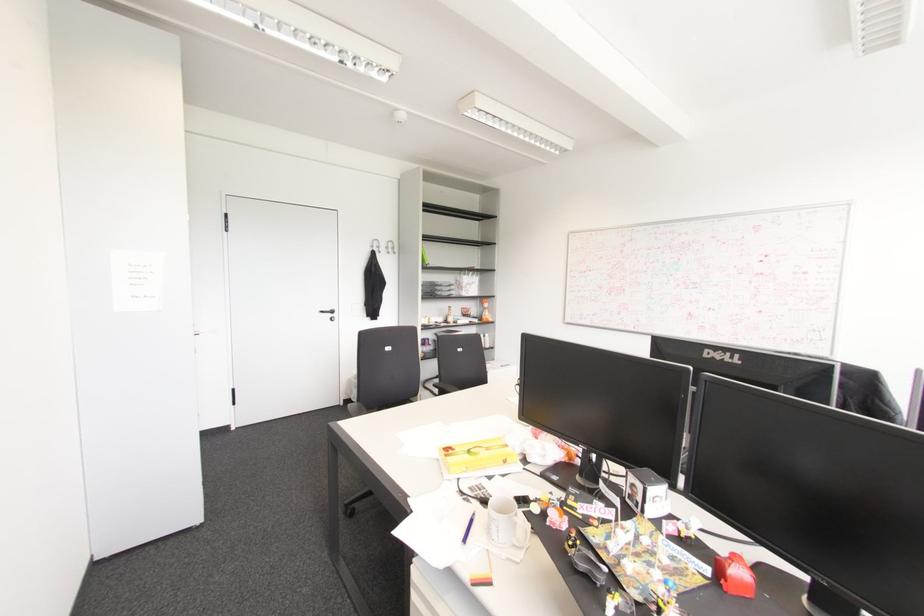
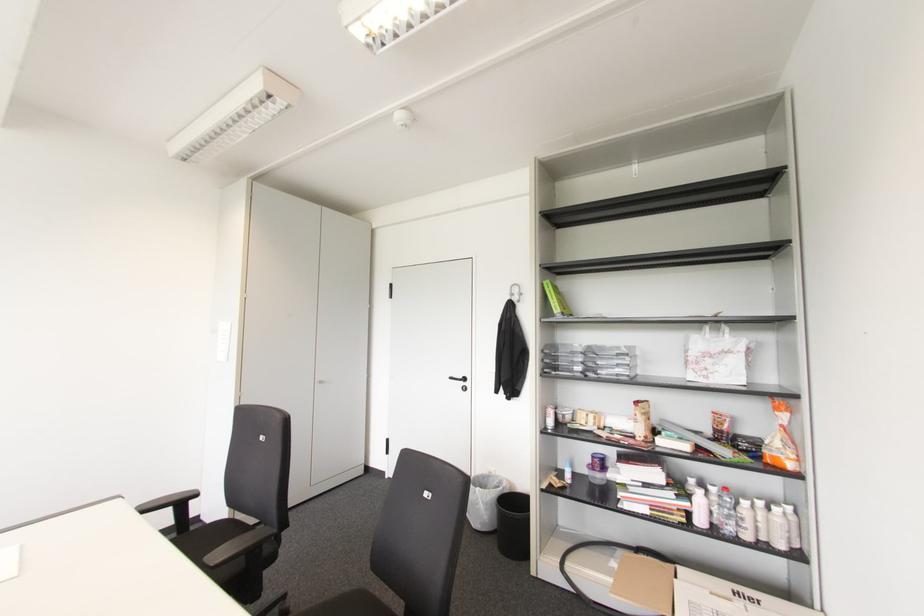
Where in the second image is the point corresponding to point 374,243 from the first image?

(516, 290)